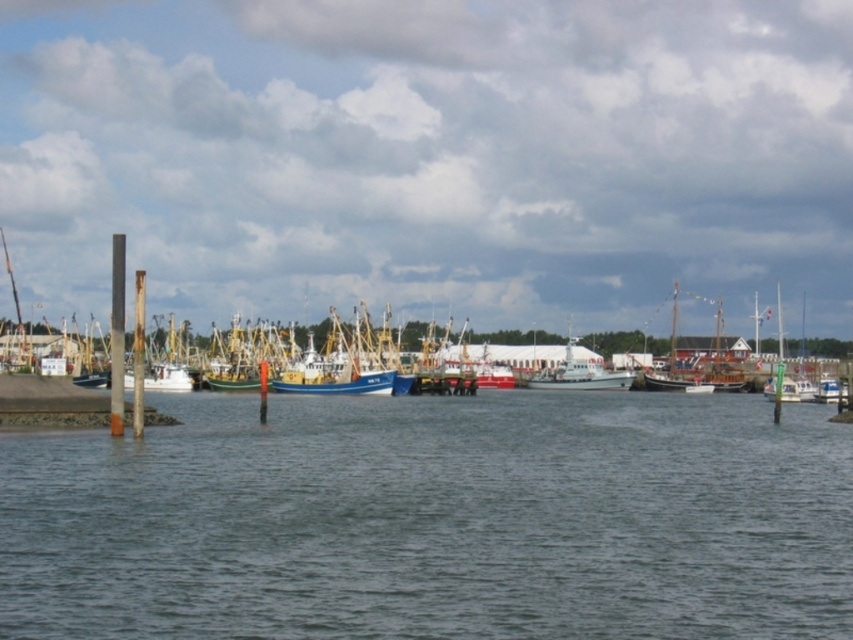
Question: Which point is closer to the camera?

Choices:
 (A) (590, 381)
 (B) (322, 387)

Answer: (B)

Question: Can you confirm if clear water at center is positioned to the left of white matte boat at center?

Choices:
 (A) no
 (B) yes

Answer: (B)

Question: Estimate the real-world distances between objects in this image. Which object is farther from the clear water at center?

Choices:
 (A) white matte boat at center
 (B) blue matte boat at center

Answer: (A)

Question: Does white matte boat at center have a smaller size compared to blue matte boat at center?

Choices:
 (A) no
 (B) yes

Answer: (A)

Question: Which point is farther from the camera taking this photo?

Choices:
 (A) (305, 392)
 (B) (624, 378)

Answer: (B)

Question: Is white matte boat at center to the right of blue matte boat at center from the viewer's perspective?

Choices:
 (A) no
 (B) yes

Answer: (B)